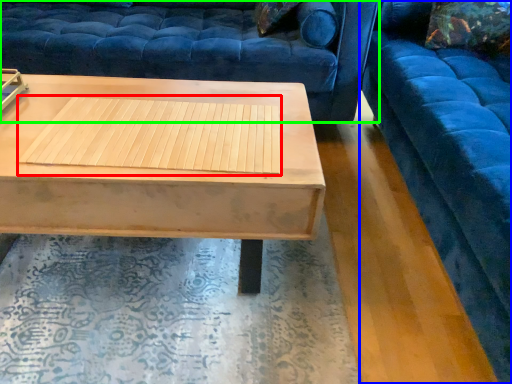
Question: Estimate the real-world distances between objects in this image. Which object is closer to wood (highlighted by a red box), studio couch (highlighted by a blue box) or studio couch (highlighted by a green box)?

Choices:
 (A) studio couch
 (B) studio couch

Answer: (B)